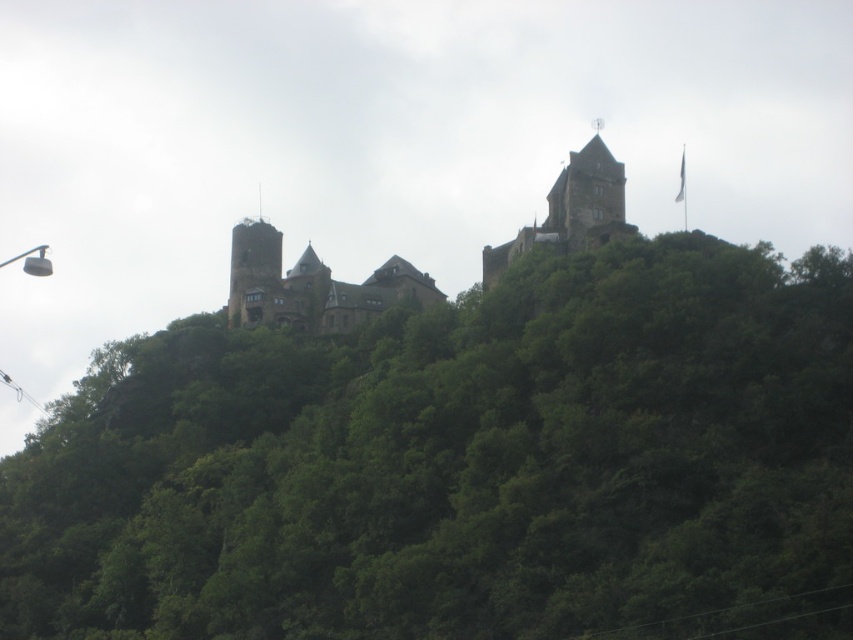
You are a medieval knight standing at the base of the hillside. You need to reach the brown stone castle at center. Which direction should you head to avoid the green leafy tree at upper center blocking your path?

The green leafy tree at upper center is to the left of the brown stone castle at center. To avoid the tree blocking your path, you should head to the right side of the castle.